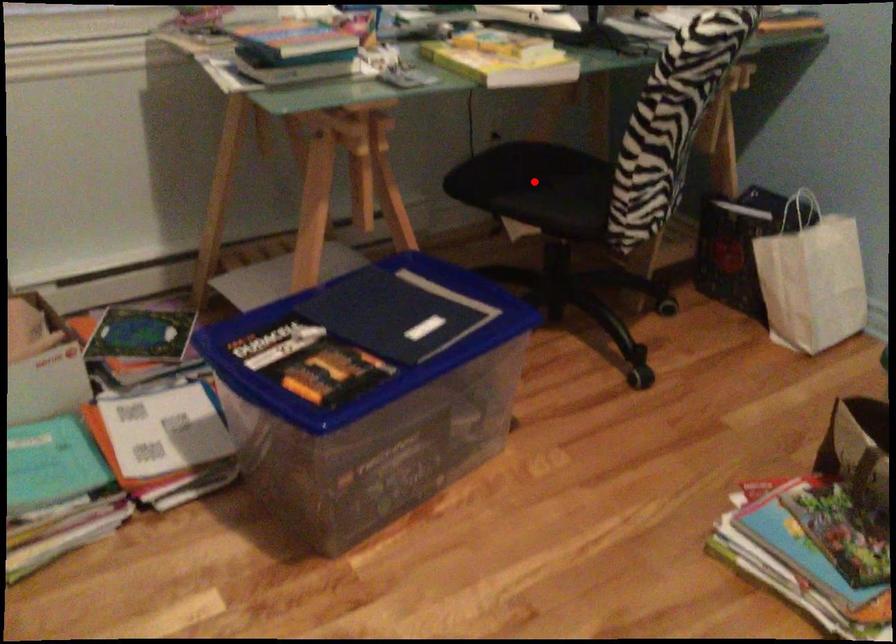
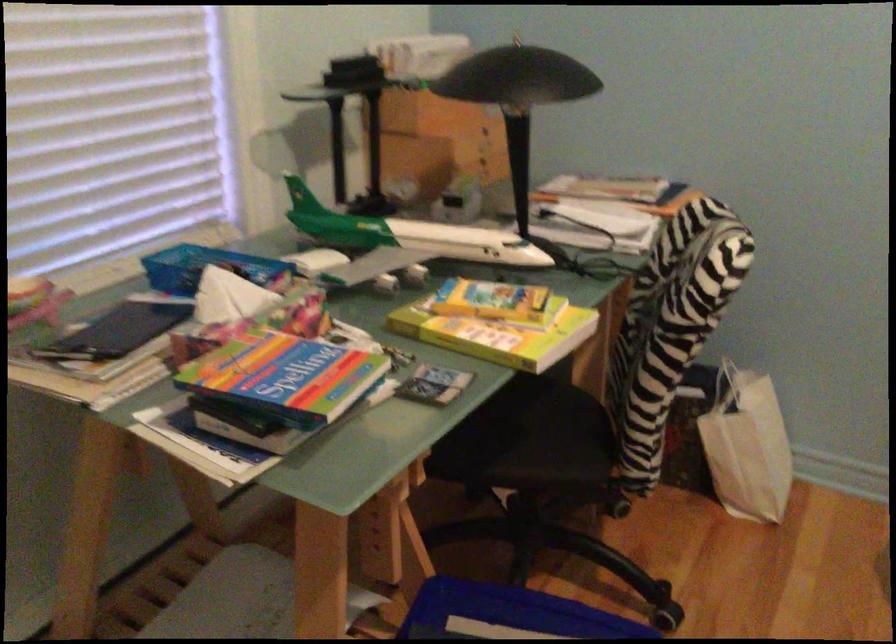
Question: I am providing you with two images of the same scene from different viewpoints. Given a red point in image1, look at the same physical point in image2. Is it:

Choices:
 (A) Closer to the viewpoint
 (B) Farther from the viewpoint

Answer: (A)